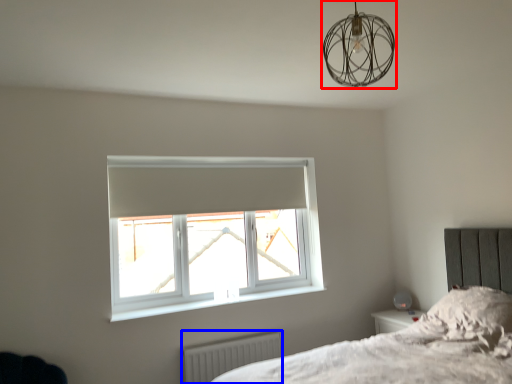
Question: Which of the following is the farthest to the observer, lamp (highlighted by a red box) or radiator (highlighted by a blue box)?

Choices:
 (A) lamp
 (B) radiator

Answer: (B)